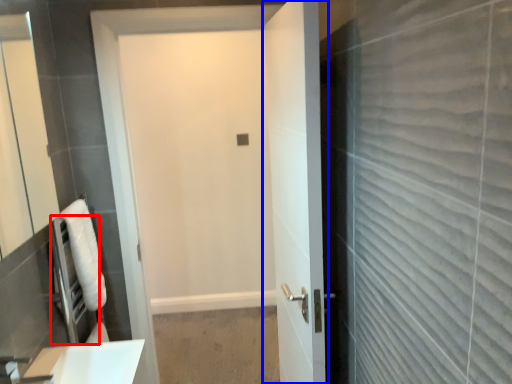
Question: Which of the following is the farthest to the observer, appliance (highlighted by a red box) or door (highlighted by a blue box)?

Choices:
 (A) appliance
 (B) door

Answer: (A)